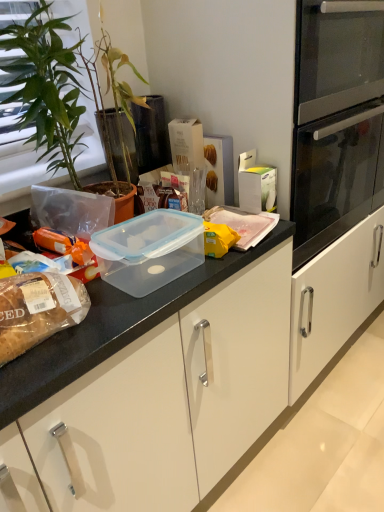
Question: Is translucent plastic container at center, the first food when ordered from right to left, bigger or smaller than transparent plastic container at center?

Choices:
 (A) big
 (B) small

Answer: (B)

Question: Is point (243, 225) closer or farther from the camera than point (178, 227)?

Choices:
 (A) closer
 (B) farther

Answer: (B)

Question: Which object is the farthest from the translucent plastic container at center, the first food when ordered from right to left?

Choices:
 (A) transparent plastic container at upper center
 (B) translucent plastic bread at left, acting as the first food starting from the left
 (C) green leafy plant at left
 (D) transparent plastic container at center

Answer: (B)

Question: Which object is positioned farthest from the translucent plastic bread at left, which is the 2th food in back-to-front order?

Choices:
 (A) transparent plastic container at center
 (B) green leafy plant at left
 (C) translucent plastic container at center, which is the first food in back-to-front order
 (D) transparent plastic container at upper center

Answer: (D)